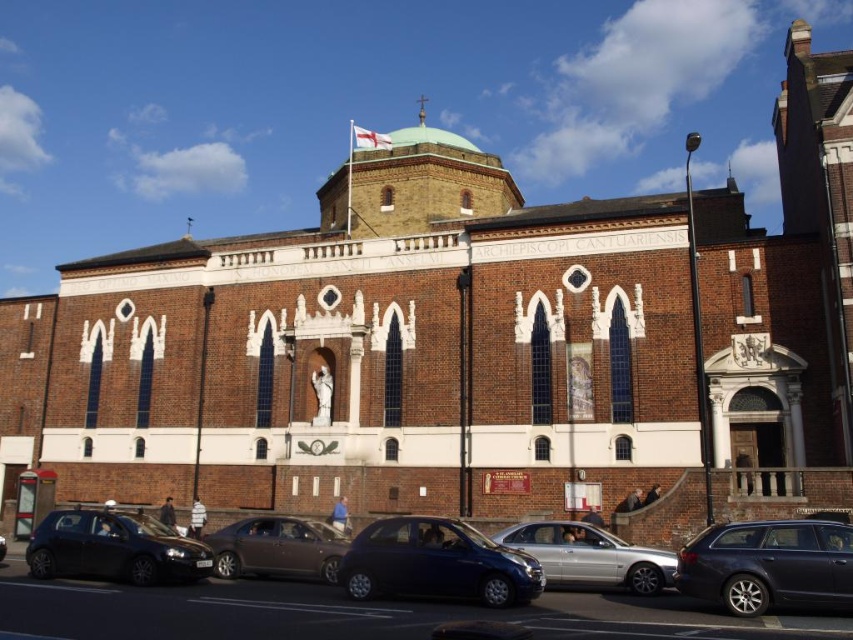
You are standing in front of the building and notice two points marked on its facade. The first point is at coordinate point [398,547] and the second is at point [567,577]. Which of these two points is closer to you as you face the building?

Point [398,547] is in front of point [567,577], so it is closer to you as you face the building.

You are a visitor at this historic building and want to park your car. You see a shiny black car at lower left and a matte brown sedan at center. Which parking spot can accommodate a larger vehicle?

The shiny black car at lower left is bigger than the matte brown sedan at center, so the parking spot where the shiny black car at lower left is parked can accommodate a larger vehicle.

You are a delivery person needing to park your 2.5 meter wide van between the shiny black car at lower left and the matte brown sedan at center. Can your van fit in the space between them?

The space between the shiny black car at lower left and the matte brown sedan at center is 3.67 meters. Since your van is 2.5 meters wide, there is enough space for it to fit between them.